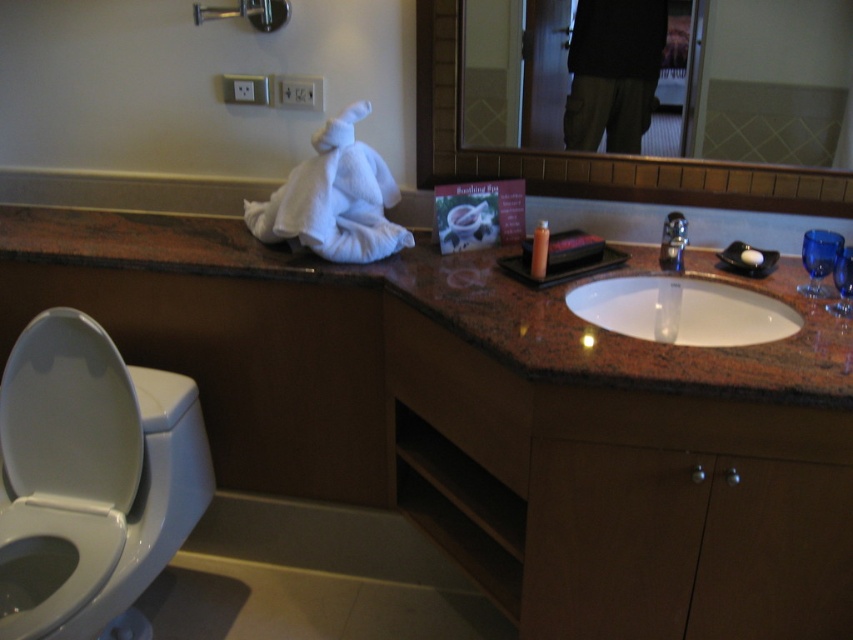
Question: Can you confirm if white glossy toilet bowl at lower left is bigger than white fluffy towel at center?

Choices:
 (A) no
 (B) yes

Answer: (B)

Question: Does glossy glass mirror at upper center appear under matte plastic soap dispenser at center?

Choices:
 (A) no
 (B) yes

Answer: (A)

Question: Estimate the real-world distances between objects in this image. Which object is closer to the white glossy toilet bowl at lower left?

Choices:
 (A) glossy glass mirror at upper center
 (B) dark fabric pants at upper center

Answer: (B)

Question: Which is farther from the glossy glass mirror at upper center?

Choices:
 (A) matte plastic soap dispenser at center
 (B) white glossy sink at center

Answer: (A)

Question: In this image, where is white glossy toilet bowl at lower left located relative to dark fabric pants at upper center?

Choices:
 (A) right
 (B) left

Answer: (B)

Question: Which of the following is the closest to the observer?

Choices:
 (A) (657, 56)
 (B) (358, 108)
 (C) (122, 618)
 (D) (843, 64)

Answer: (D)